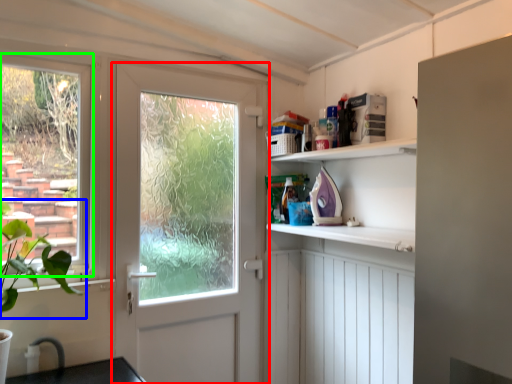
Question: Which object is the closest to the door (highlighted by a red box)? Choose among these: plant (highlighted by a blue box) or window (highlighted by a green box).

Choices:
 (A) plant
 (B) window

Answer: (B)